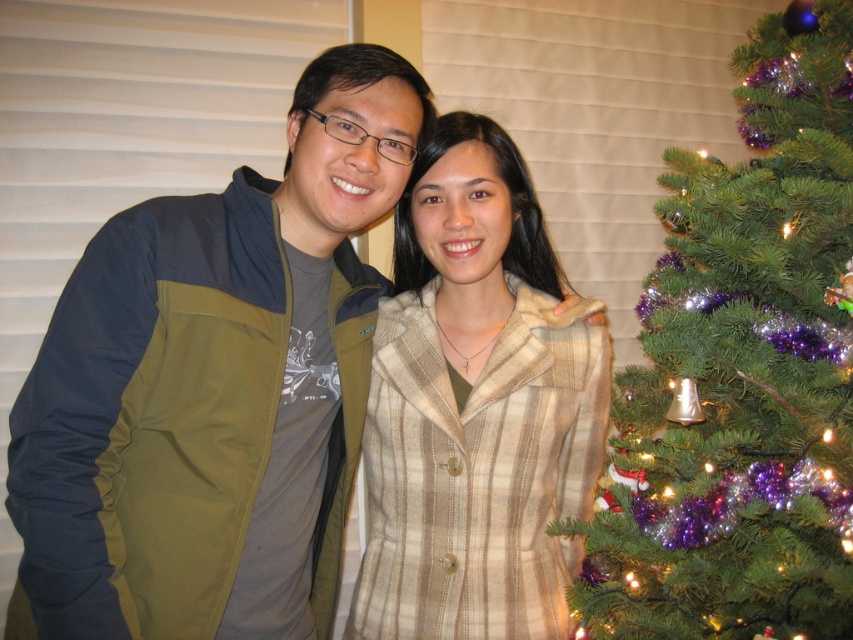
Question: Which object is positioned farthest from the matte olive green jacket at center?

Choices:
 (A) green shiny pine tree at right
 (B) beige plaid coat at center

Answer: (A)

Question: Is matte olive green jacket at center bigger than beige plaid coat at center?

Choices:
 (A) yes
 (B) no

Answer: (A)

Question: Does green shiny pine tree at right have a lesser width compared to beige plaid coat at center?

Choices:
 (A) no
 (B) yes

Answer: (A)

Question: Among these objects, which one is nearest to the camera?

Choices:
 (A) green shiny pine tree at right
 (B) beige plaid coat at center
 (C) matte olive green jacket at center

Answer: (C)

Question: Among these objects, which one is farthest from the camera?

Choices:
 (A) matte olive green jacket at center
 (B) green shiny pine tree at right
 (C) beige plaid coat at center

Answer: (C)

Question: Is matte olive green jacket at center smaller than beige plaid coat at center?

Choices:
 (A) yes
 (B) no

Answer: (B)